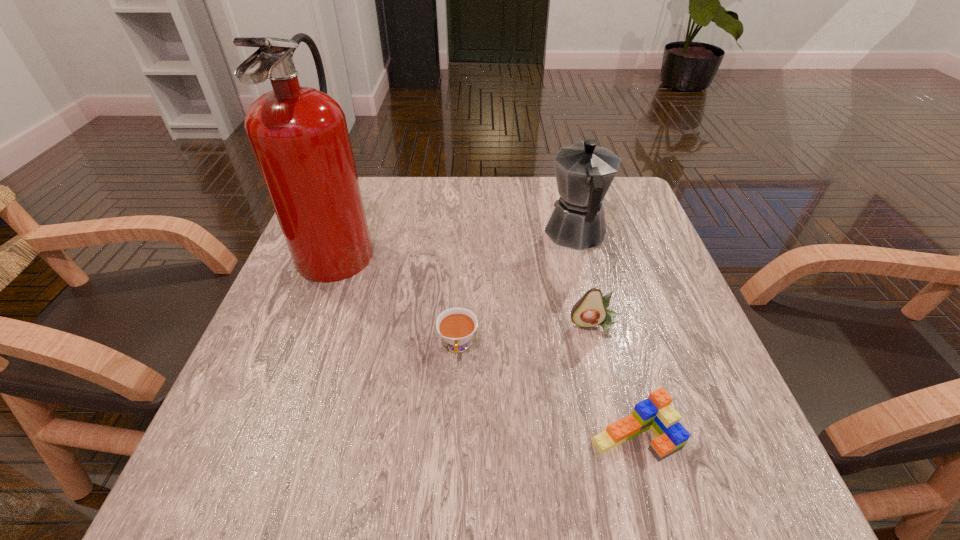
Locate an element on the screen. The height and width of the screenshot is (540, 960). object that is at the far right corner is located at coordinates (584, 172).

Locate an element on the screen. Image resolution: width=960 pixels, height=540 pixels. object located at the near right corner is located at coordinates pos(655,413).

The width and height of the screenshot is (960, 540). Identify the location of blank space at the far edge of the desktop. (395, 206).

Where is `free spot at the near edge of the desktop`? This screenshot has height=540, width=960. free spot at the near edge of the desktop is located at coordinates (305, 497).

Locate an element on the screen. free space at the left edge of the desktop is located at coordinates (267, 342).

You are a GUI agent. You are given a task and a screenshot of the screen. Output one action in this format:
    pyautogui.click(x=<x>, y=<y>)
    Task: Click on the vacant space at the right edge of the desktop
    
    Given the screenshot: What is the action you would take?
    pyautogui.click(x=659, y=260)

This screenshot has width=960, height=540. What are the coordinates of `blank space at the near left corner of the desktop` in the screenshot? It's located at pyautogui.click(x=284, y=497).

At what (x,y) coordinates should I click in order to perform the action: click on vacant space at the far right corner. Please return your answer as a coordinate pair (x, y). This screenshot has height=540, width=960. Looking at the image, I should click on (628, 178).

Locate an element on the screen. This screenshot has width=960, height=540. blank region between the fire extinguisher and the second tallest object is located at coordinates (457, 240).

This screenshot has height=540, width=960. Find the location of `free space between the second tallest object and the nearest object`. free space between the second tallest object and the nearest object is located at coordinates (605, 335).